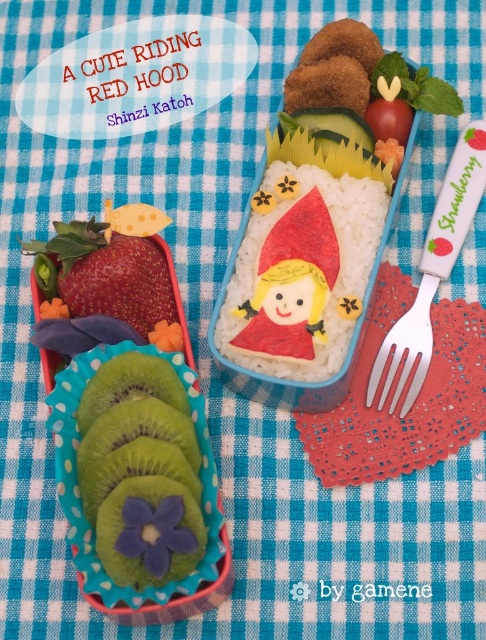
Question: Is green textured kiwi at lower left below silver metallic fork at right?

Choices:
 (A) yes
 (B) no

Answer: (A)

Question: Among these points, which one is farthest from the camera?

Choices:
 (A) (90, 468)
 (B) (450, 266)
 (C) (298, 186)
 (D) (135, 250)

Answer: (B)

Question: Which point is farther from the camera taking this photo?

Choices:
 (A) (82, 268)
 (B) (189, 445)
 (C) (380, 196)
 (D) (396, 365)

Answer: (D)

Question: Is the position of green textured kiwi at lower left less distant than that of silver metallic fork at right?

Choices:
 (A) yes
 (B) no

Answer: (A)

Question: Which is farther from the shiny red strawberry at left?

Choices:
 (A) green textured kiwi at lower left
 (B) white rice at center
 (C) silver metallic fork at right

Answer: (C)

Question: Does white rice at center have a lesser width compared to green textured kiwi at lower left?

Choices:
 (A) yes
 (B) no

Answer: (B)